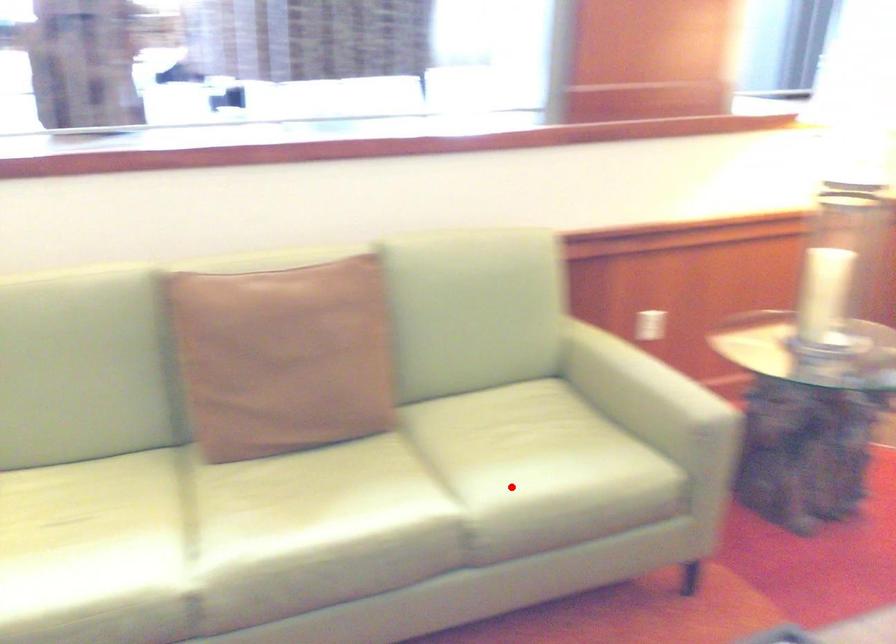
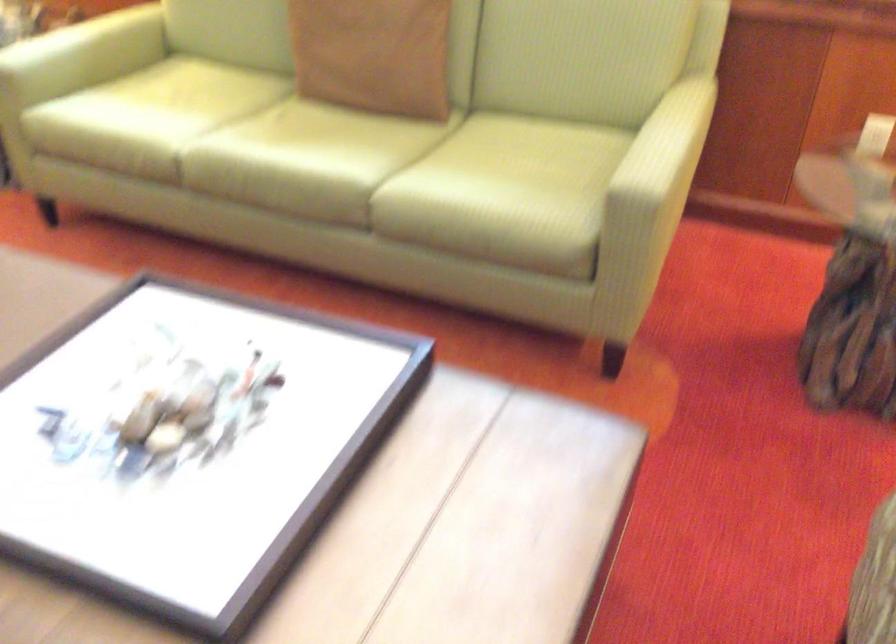
In the second image, find the point that corresponds to the highlighted location in the first image.

(429, 182)